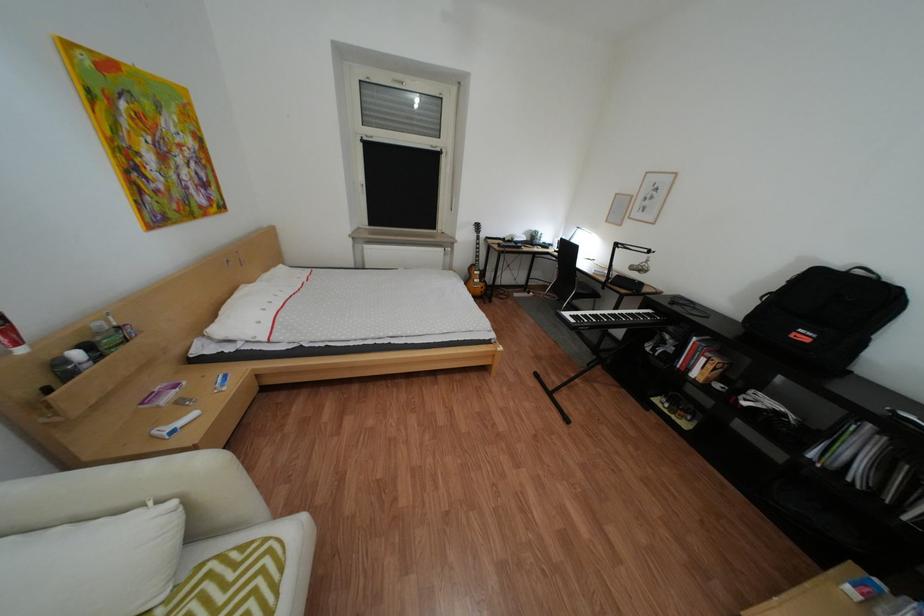
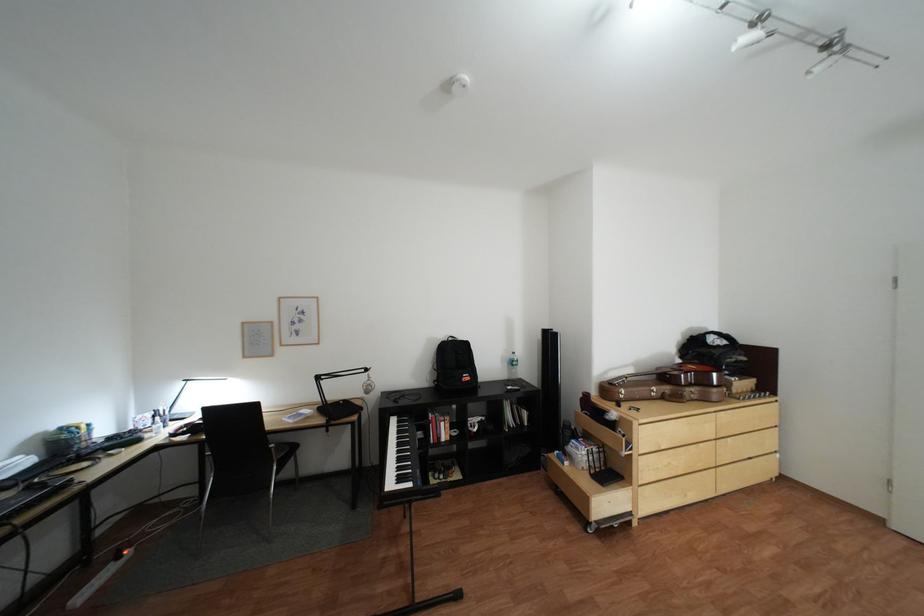
Where in the second image is the point corresponding to the point at 874,273 from the first image?

(466, 339)